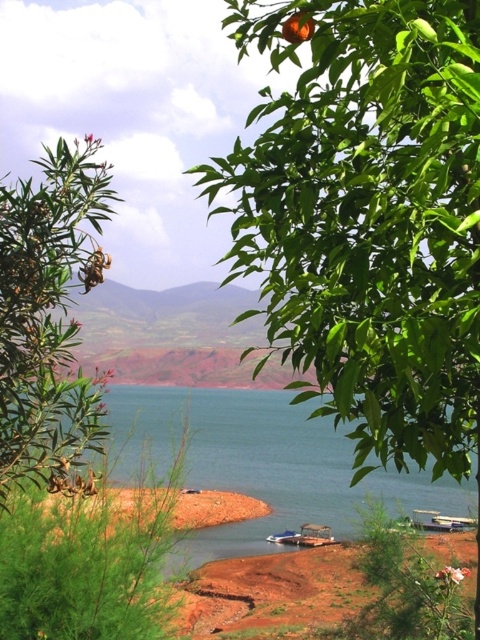
Question: From the image, what is the correct spatial relationship of green leafy tree at upper right in relation to metallic silver boat at center?

Choices:
 (A) below
 (B) above

Answer: (B)

Question: Where is green leafy tree at upper right located in relation to blue water at center in the image?

Choices:
 (A) below
 (B) above

Answer: (B)

Question: Which point is closer to the camera taking this photo?

Choices:
 (A) pos(290,538)
 (B) pos(412,104)

Answer: (B)

Question: Is blue water at center to the right of metallic silver boat at center from the viewer's perspective?

Choices:
 (A) yes
 (B) no

Answer: (B)

Question: Considering the real-world distances, which object is farthest from the green leafy tree at upper right?

Choices:
 (A) green leafy shrub at left
 (B) blue water at center
 (C) metallic silver boat at center

Answer: (C)

Question: Which object appears farthest from the camera in this image?

Choices:
 (A) green leafy shrub at left
 (B) blue water at center
 (C) green leafy tree at upper right
 (D) metallic silver boat at center

Answer: (D)